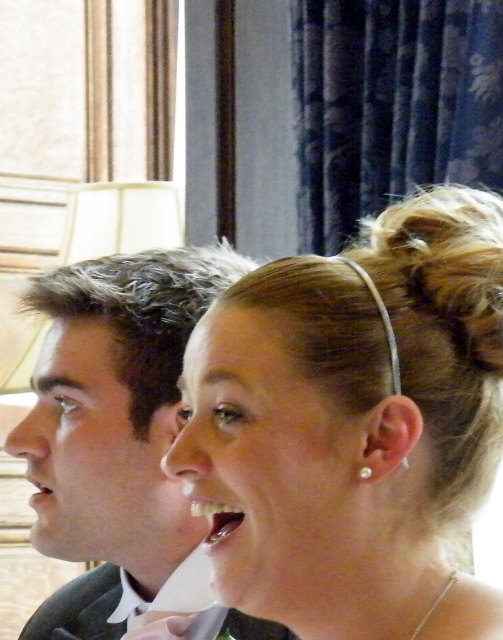
Question: Can you confirm if matte black suit at left is smaller than matte white teeth at lower left?

Choices:
 (A) yes
 (B) no

Answer: (B)

Question: Which of these objects is positioned closest to the matte black suit at left?

Choices:
 (A) white glossy teeth at center
 (B) matte silver headband at upper center

Answer: (B)

Question: Which point is farther from the camera taking this photo?

Choices:
 (A) (240, 292)
 (B) (217, 538)
 (C) (95, 484)
 (D) (39, 480)

Answer: (D)

Question: Which object appears closest to the camera in this image?

Choices:
 (A) matte white teeth at lower left
 (B) matte silver headband at upper center

Answer: (B)

Question: Does white glossy teeth at center have a lesser width compared to matte white teeth at lower left?

Choices:
 (A) yes
 (B) no

Answer: (A)

Question: Does matte black suit at left have a lesser width compared to matte white teeth at lower left?

Choices:
 (A) no
 (B) yes

Answer: (A)